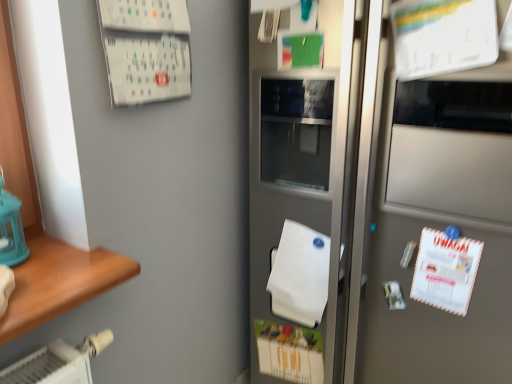
Locate an element on the screen. The height and width of the screenshot is (384, 512). satin silver refrigerator at center is located at coordinates (429, 214).

Describe the element at coordinates (429, 214) in the screenshot. I see `satin silver refrigerator at center` at that location.

This screenshot has height=384, width=512. Find the location of `white matte wrapping paper at center`. white matte wrapping paper at center is located at coordinates (300, 274).

What do you see at coordinates (300, 274) in the screenshot? I see `white matte wrapping paper at center` at bounding box center [300, 274].

What is the approximate width of white matte wrapping paper at center?

It is 3.60 inches.

In order to face white matte wrapping paper at center, should I rotate leftwards or rightwards?

Rotate your view right by about 6.279°.

At what (x,y) coordinates should I click in order to perform the action: click on satin silver refrigerator at center. Please return your answer as a coordinate pair (x, y). Looking at the image, I should click on (429, 214).

Between satin silver refrigerator at center and white matte wrapping paper at center, which one appears on the right side from the viewer's perspective?

satin silver refrigerator at center.

Is satin silver refrigerator at center in front of or behind white matte wrapping paper at center in the image?

In the image, satin silver refrigerator at center appears in front of white matte wrapping paper at center.

Does point (376, 46) come behind point (286, 234)?

No, it is not.

From the image's perspective, does satin silver refrigerator at center appear higher than white matte wrapping paper at center?

Yes, from the image's perspective, satin silver refrigerator at center is over white matte wrapping paper at center.

From a real-world perspective, is satin silver refrigerator at center beneath white matte wrapping paper at center?

No, from a real-world perspective, satin silver refrigerator at center is not under white matte wrapping paper at center.

Looking at their sizes, would you say satin silver refrigerator at center is wider or thinner than white matte wrapping paper at center?

Clearly, satin silver refrigerator at center has more width compared to white matte wrapping paper at center.

Considering the sizes of satin silver refrigerator at center and white matte wrapping paper at center in the image, is satin silver refrigerator at center taller or shorter than white matte wrapping paper at center?

Clearly, satin silver refrigerator at center is taller compared to white matte wrapping paper at center.

Which of these two, satin silver refrigerator at center or white matte wrapping paper at center, is smaller?

Smaller between the two is white matte wrapping paper at center.

From the picture: Would you say satin silver refrigerator at center is inside or outside white matte wrapping paper at center?

satin silver refrigerator at center cannot be found inside white matte wrapping paper at center.

Based on the photo, is satin silver refrigerator at center far away from white matte wrapping paper at center?

No, satin silver refrigerator at center is in close proximity to white matte wrapping paper at center.

Is satin silver refrigerator at center looking in the opposite direction of white matte wrapping paper at center?

Yes, satin silver refrigerator at center's orientation is away from white matte wrapping paper at center.

How many degrees apart are the facing directions of satin silver refrigerator at center and white matte wrapping paper at center?

1.23 degrees separate the facing orientations of satin silver refrigerator at center and white matte wrapping paper at center.

How much distance is there between satin silver refrigerator at center and white matte wrapping paper at center?

The distance of satin silver refrigerator at center from white matte wrapping paper at center is 11.14 inches.

Where is `wrapping paper on the left of satin silver refrigerator at center`? This screenshot has height=384, width=512. wrapping paper on the left of satin silver refrigerator at center is located at coordinates (300, 274).

Considering the relative positions of white matte wrapping paper at center and satin silver refrigerator at center in the image provided, is white matte wrapping paper at center to the left of satin silver refrigerator at center from the viewer's perspective?

Yes, white matte wrapping paper at center is to the left of satin silver refrigerator at center.

Is white matte wrapping paper at center positioned before satin silver refrigerator at center?

No, white matte wrapping paper at center is further to the viewer.

Which is in front, point (292, 294) or point (406, 124)?

Positioned in front is point (406, 124).

From the image's perspective, which one is positioned lower, white matte wrapping paper at center or satin silver refrigerator at center?

white matte wrapping paper at center is shown below in the image.

From a real-world perspective, is white matte wrapping paper at center located higher than satin silver refrigerator at center?

No, from a real-world perspective, white matte wrapping paper at center is not over satin silver refrigerator at center

Considering the relative sizes of white matte wrapping paper at center and satin silver refrigerator at center in the image provided, is white matte wrapping paper at center thinner than satin silver refrigerator at center?

Correct, the width of white matte wrapping paper at center is less than that of satin silver refrigerator at center.

Considering the relative sizes of white matte wrapping paper at center and satin silver refrigerator at center in the image provided, is white matte wrapping paper at center taller than satin silver refrigerator at center?

No.

Considering the sizes of objects white matte wrapping paper at center and satin silver refrigerator at center in the image provided, who is smaller, white matte wrapping paper at center or satin silver refrigerator at center?

white matte wrapping paper at center.

Is white matte wrapping paper at center inside or outside of satin silver refrigerator at center?

white matte wrapping paper at center can be found inside satin silver refrigerator at center.

Would you consider white matte wrapping paper at center to be distant from satin silver refrigerator at center?

No.

Is white matte wrapping paper at center oriented away from satin silver refrigerator at center?

Absolutely, white matte wrapping paper at center is directed away from satin silver refrigerator at center.

Can you tell me how much white matte wrapping paper at center and satin silver refrigerator at center differ in facing direction?

The facing directions of white matte wrapping paper at center and satin silver refrigerator at center are 1.23 degrees apart.

How far apart are white matte wrapping paper at center and satin silver refrigerator at center?

white matte wrapping paper at center and satin silver refrigerator at center are 11.14 inches apart.

The image size is (512, 384). Find the location of `wrapping paper lying below the satin silver refrigerator at center (from the image's perspective)`. wrapping paper lying below the satin silver refrigerator at center (from the image's perspective) is located at coordinates (300, 274).

Locate an element on the screen. The width and height of the screenshot is (512, 384). wrapping paper on the left of satin silver refrigerator at center is located at coordinates (300, 274).

At what (x,y) coordinates should I click in order to perform the action: click on refrigerator above the white matte wrapping paper at center (from a real-world perspective). Please return your answer as a coordinate pair (x, y). Looking at the image, I should click on (429, 214).